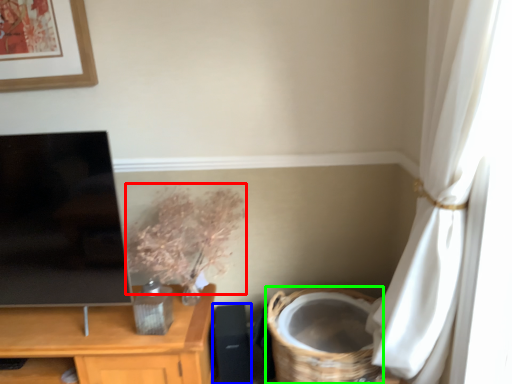
Question: Which object is positioned closest to floral arrangement (highlighted by a red box)? Select from speaker (highlighted by a blue box) and basket (highlighted by a green box).

Choices:
 (A) speaker
 (B) basket

Answer: (A)